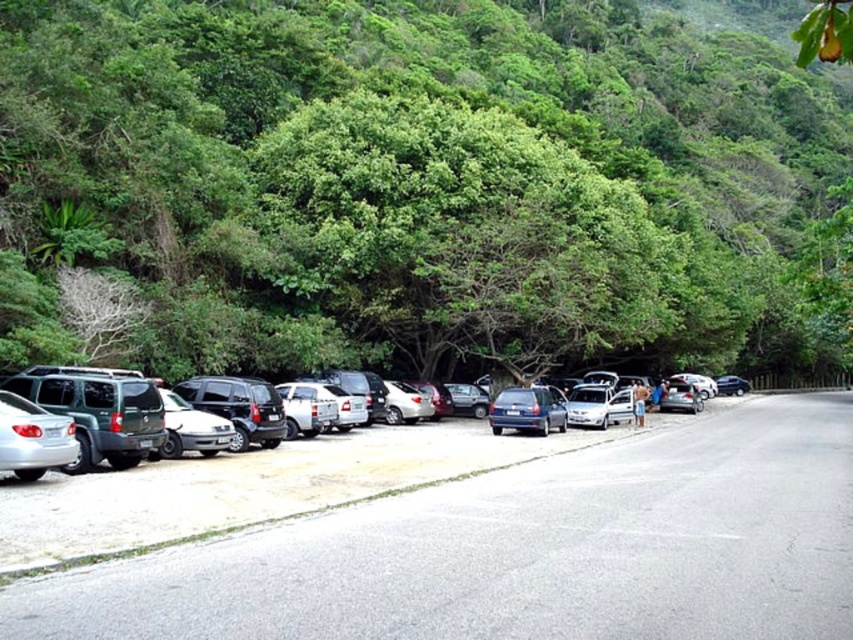
Question: Does green leafy tree at center appear over matte green suv at left?

Choices:
 (A) yes
 (B) no

Answer: (A)

Question: Estimate the real-world distances between objects in this image. Which object is farther from the green leafy tree at center?

Choices:
 (A) satin silver sedan at lower left
 (B) metallic silver car at center
 (C) matte green suv at left

Answer: (B)

Question: Estimate the real-world distances between objects in this image. Which object is farther from the matte green suv at left?

Choices:
 (A) blue metallic hatchback at center
 (B) metallic silver car at center
 (C) satin silver sedan at lower left

Answer: (A)

Question: Can you confirm if satin silver sedan at lower left is bigger than blue metallic hatchback at center?

Choices:
 (A) no
 (B) yes

Answer: (A)

Question: Is metallic silver car at center to the left of blue metallic hatchback at center from the viewer's perspective?

Choices:
 (A) yes
 (B) no

Answer: (B)

Question: Which object is closer to the camera taking this photo?

Choices:
 (A) matte green suv at left
 (B) metallic silver car at center

Answer: (B)